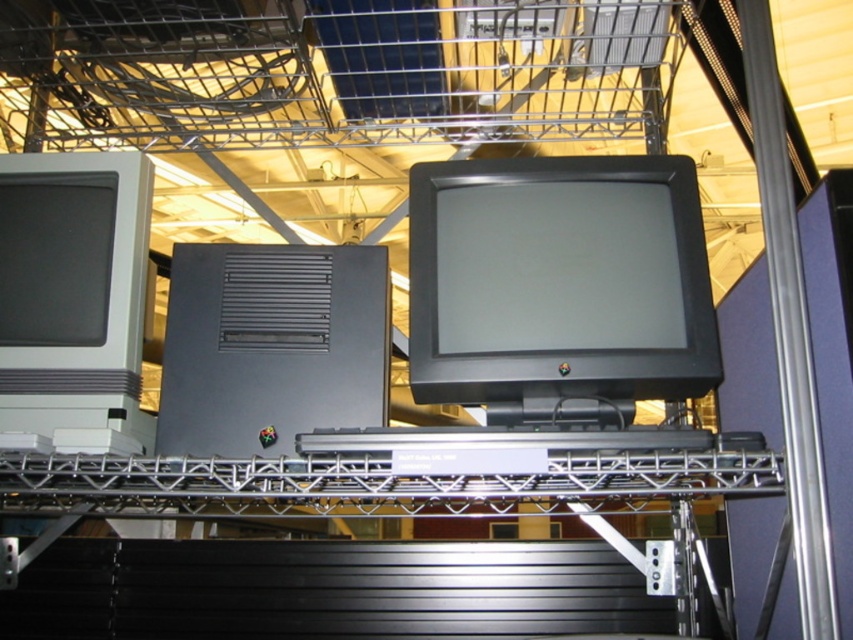
Who is positioned more to the left, black plastic computer at center or matte gray monitor at left?

Positioned to the left is matte gray monitor at left.

Is black plastic computer at center behind matte gray monitor at left?

Yes, it is.

The width and height of the screenshot is (853, 640). Identify the location of black plastic computer at center. (271, 346).

Describe the element at coordinates (558, 280) in the screenshot. The height and width of the screenshot is (640, 853). I see `matte black monitor at center` at that location.

Is point (508, 340) closer to viewer compared to point (279, 442)?

That is False.

Between point (675, 396) and point (352, 365), which one is positioned in front?

Positioned in front is point (352, 365).

At what (x,y) coordinates should I click in order to perform the action: click on matte black monitor at center. Please return your answer as a coordinate pair (x, y). The height and width of the screenshot is (640, 853). Looking at the image, I should click on (558, 280).

Does point (527, 234) come in front of point (120, 225)?

Yes, it is.

Who is lower down, matte black monitor at center or matte gray monitor at left?

matte gray monitor at left is below.

Who is more distant from viewer, (511, 310) or (51, 349)?

The point (51, 349) is more distant.

Find the location of a particular element. This screenshot has height=640, width=853. matte black monitor at center is located at coordinates (558, 280).